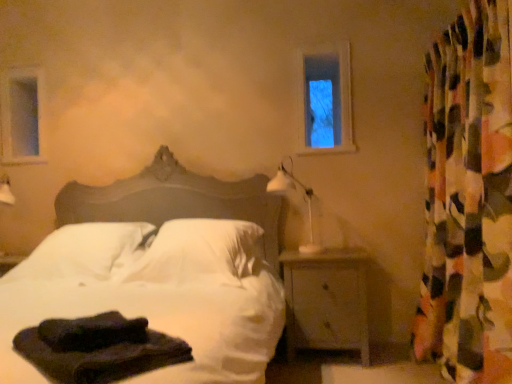
Question: Would you say multicolored fabric curtain at right contains clear glass window at upper center, arranged as the first window frame when viewed from the front?

Choices:
 (A) no
 (B) yes

Answer: (A)

Question: From the image's perspective, does multicolored fabric curtain at right appear lower than clear glass window at upper center, placed as the 2th window frame when sorted from left to right?

Choices:
 (A) no
 (B) yes

Answer: (B)

Question: Does multicolored fabric curtain at right have a greater width compared to clear glass window at upper center, placed as the 2th window frame when sorted from left to right?

Choices:
 (A) yes
 (B) no

Answer: (A)

Question: From a real-world perspective, is multicolored fabric curtain at right on clear glass window at upper center, arranged as the first window frame when viewed from the front?

Choices:
 (A) yes
 (B) no

Answer: (B)

Question: Is multicolored fabric curtain at right oriented away from clear glass window at upper center, placed as the 2th window frame when sorted from left to right?

Choices:
 (A) yes
 (B) no

Answer: (B)

Question: In terms of width, does white soft pillow at center, the 2th pillow positioned from the right, look wider or thinner when compared to dark fabric at lower left, the first material from the top?

Choices:
 (A) wide
 (B) thin

Answer: (A)

Question: Based on their sizes in the image, would you say white soft pillow at center, arranged as the 1th pillow when viewed from the left, is bigger or smaller than dark fabric at lower left, the 2th material in the bottom-to-top sequence?

Choices:
 (A) big
 (B) small

Answer: (A)

Question: From their relative heights in the image, would you say white soft pillow at center, arranged as the 1th pillow when viewed from the left, is taller or shorter than dark fabric at lower left, the 2th material in the bottom-to-top sequence?

Choices:
 (A) short
 (B) tall

Answer: (B)

Question: Relative to dark fabric at lower left, the 2th material in the bottom-to-top sequence, is white soft pillow at center, arranged as the 1th pillow when viewed from the left, in front or behind?

Choices:
 (A) front
 (B) behind

Answer: (B)

Question: From a real-world perspective, is white soft pillow at center, which appears as the 2th pillow when viewed from the left, physically located above or below dark fabric at lower left, which is the first material in bottom-to-top order?

Choices:
 (A) below
 (B) above

Answer: (B)

Question: From their relative heights in the image, would you say white soft pillow at center, the 1th pillow when ordered from right to left, is taller or shorter than dark fabric at lower left, which is the first material in bottom-to-top order?

Choices:
 (A) short
 (B) tall

Answer: (B)

Question: Is white soft pillow at center, which appears as the 2th pillow when viewed from the left, situated inside dark fabric at lower left, which is the first material in bottom-to-top order, or outside?

Choices:
 (A) outside
 (B) inside

Answer: (A)

Question: Does point (165, 238) appear closer or farther from the camera than point (154, 334)?

Choices:
 (A) closer
 (B) farther

Answer: (B)

Question: Does point (494, 251) appear closer or farther from the camera than point (49, 248)?

Choices:
 (A) closer
 (B) farther

Answer: (A)

Question: Is multicolored fabric curtain at right inside the boundaries of white soft bed at center, or outside?

Choices:
 (A) inside
 (B) outside

Answer: (B)